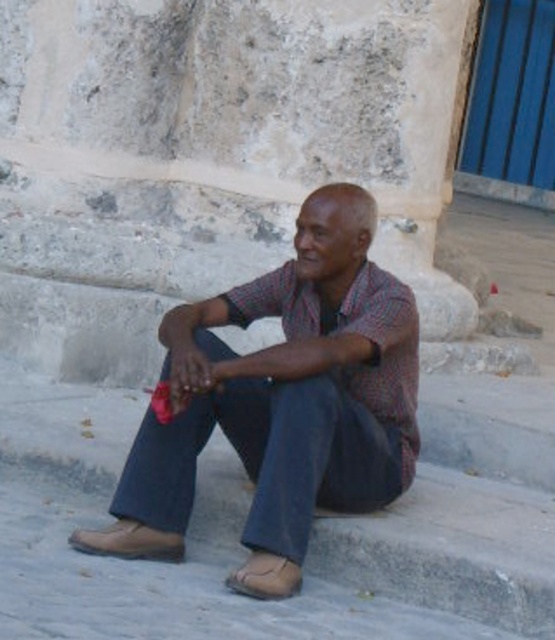
You are a photographer trying to capture the brown leather sandal at lower left and the brown leather sandal at lower center in a single shot. Which sandal is covering the other one?

The brown leather sandal at lower left is positioned over the brown leather sandal at lower center, so it is covering the other one.

Based on the photo, you are standing at the center of the image and want to pick up the brown leather sandal at lower left. In which direction should you move to reach it?

The brown leather sandal at lower left is located at point (128, 541), which means it is positioned to the right and slightly below the center. Move towards the lower right direction to reach it.

You are a fashion designer observing the elderly man in the scene. You need to determine the spatial relationship between the checkered fabric shirt at center and the brown leather sandal at lower center. Which object is located higher in the image?

The checkered fabric shirt at center is positioned over brown leather sandal at lower center, so the checkered fabric shirt at center is higher in the image.